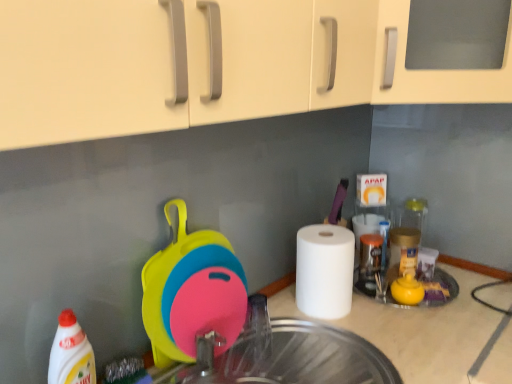
At what (x,y) coordinates should I click in order to perform the action: click on free space behind metallic silver faucet at center. Please return your answer as a coordinate pair (x, y). Looking at the image, I should click on (274, 324).